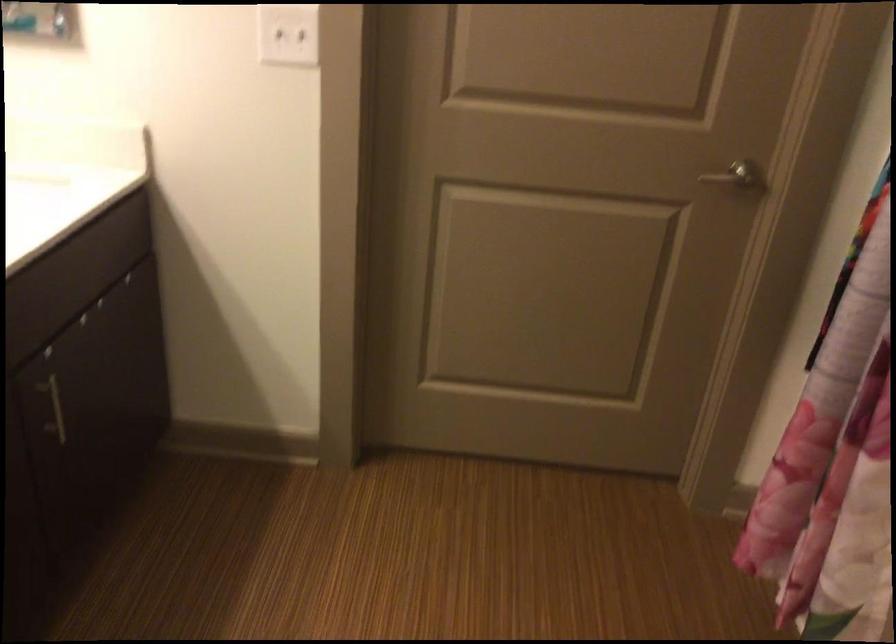
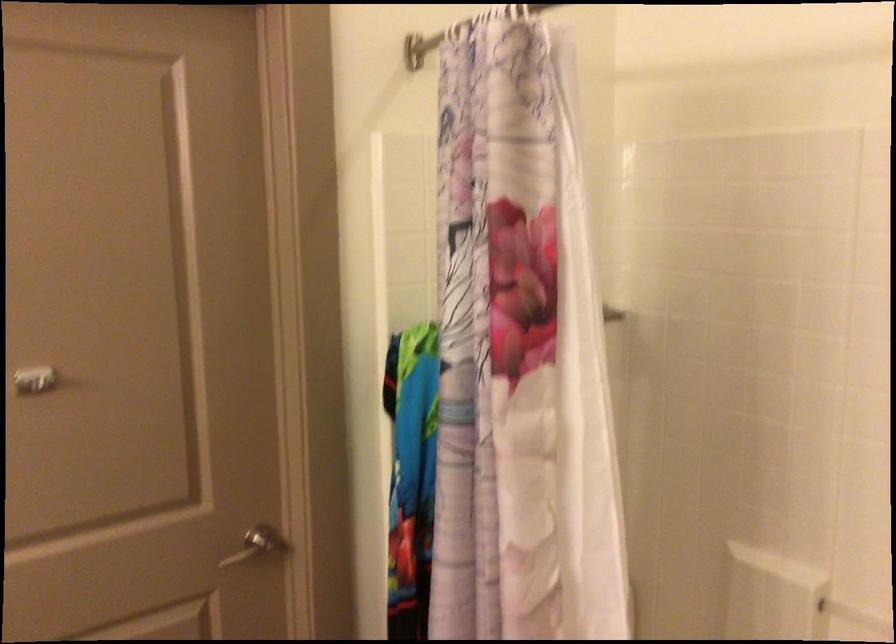
The point at [738,173] is marked in the first image. Where is the corresponding point in the second image?

(257, 545)